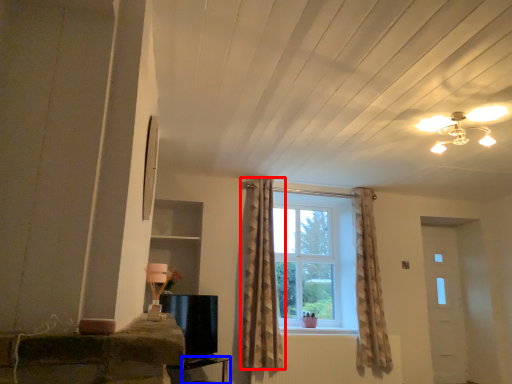
Question: Which of the following is the farthest to the observer, curtain (highlighted by a red box) or table (highlighted by a blue box)?

Choices:
 (A) curtain
 (B) table

Answer: (A)